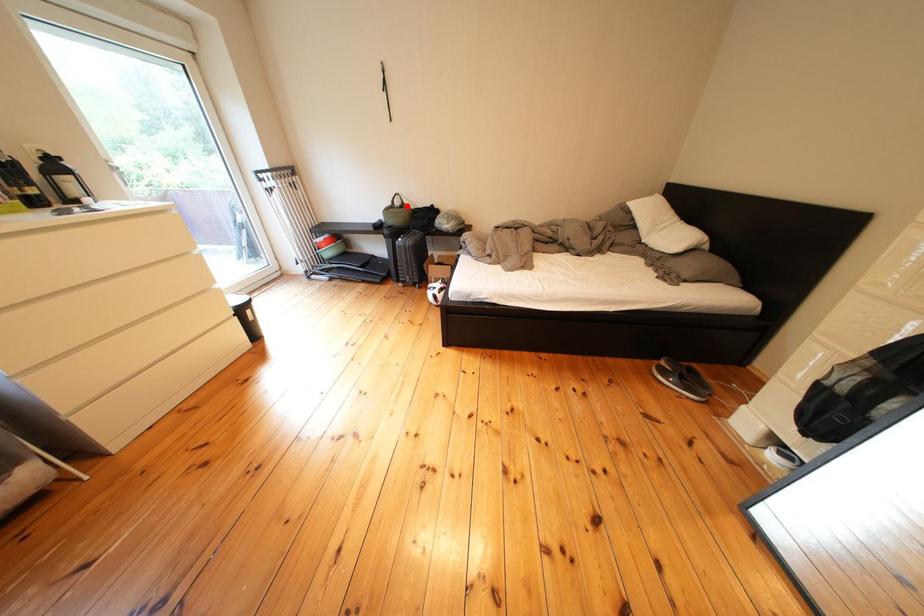
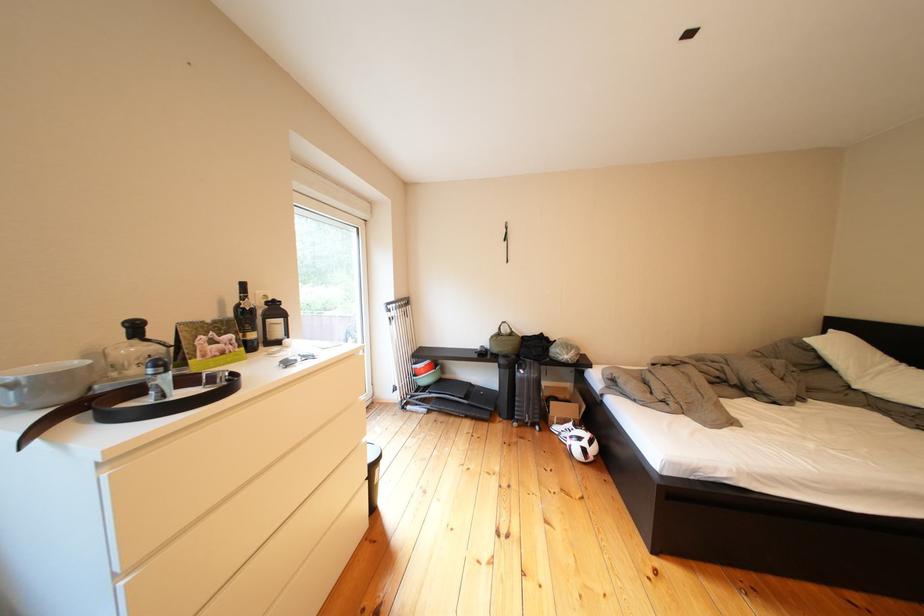
Question: I am providing you with two images of the same scene from different viewpoints. In image1, a red point is highlighted. Considering the same 3D point in image2, which of the following is correct?

Choices:
 (A) It is closer
 (B) It is farther

Answer: (B)